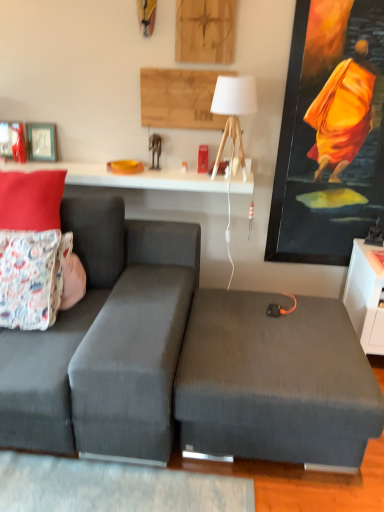
Question: Can you confirm if white glossy table at upper center is thinner than dark gray fabric ottoman at center?

Choices:
 (A) yes
 (B) no

Answer: (A)

Question: From the image's perspective, is white glossy table at upper center on top of dark gray fabric ottoman at center?

Choices:
 (A) yes
 (B) no

Answer: (A)

Question: Is white glossy table at upper center not inside dark gray fabric ottoman at center?

Choices:
 (A) no
 (B) yes

Answer: (B)

Question: Does white glossy table at upper center have a greater height compared to dark gray fabric ottoman at center?

Choices:
 (A) no
 (B) yes

Answer: (A)

Question: Could you tell me if white glossy table at upper center is turned towards dark gray fabric ottoman at center?

Choices:
 (A) yes
 (B) no

Answer: (B)

Question: Considering the relative sizes of white glossy table at upper center and dark gray fabric ottoman at center in the image provided, is white glossy table at upper center shorter than dark gray fabric ottoman at center?

Choices:
 (A) no
 (B) yes

Answer: (B)

Question: From a real-world perspective, does matte black picture frame at upper left, which ranks as the 1th picture frame in left-to-right order, stand above white matte table lamp at upper center?

Choices:
 (A) yes
 (B) no

Answer: (B)

Question: From the image's perspective, is matte black picture frame at upper left, which is the second picture frame in right-to-left order, under white matte table lamp at upper center?

Choices:
 (A) no
 (B) yes

Answer: (A)

Question: Is matte black picture frame at upper left, which is the second picture frame in right-to-left order, oriented away from white matte table lamp at upper center?

Choices:
 (A) yes
 (B) no

Answer: (B)

Question: Does matte black picture frame at upper left, which ranks as the 1th picture frame in left-to-right order, have a greater width compared to white matte table lamp at upper center?

Choices:
 (A) yes
 (B) no

Answer: (B)

Question: From the image's perspective, would you say matte black picture frame at upper left, which is the second picture frame in right-to-left order, is positioned over white matte table lamp at upper center?

Choices:
 (A) yes
 (B) no

Answer: (A)

Question: Could white matte table lamp at upper center be considered to be inside matte black picture frame at upper left, which ranks as the 1th picture frame in left-to-right order?

Choices:
 (A) yes
 (B) no

Answer: (B)

Question: Is dark gray fabric couch at left facing towards matte fabric pillow at upper left, positioned as the 2th pillow in bottom-to-top order?

Choices:
 (A) yes
 (B) no

Answer: (B)